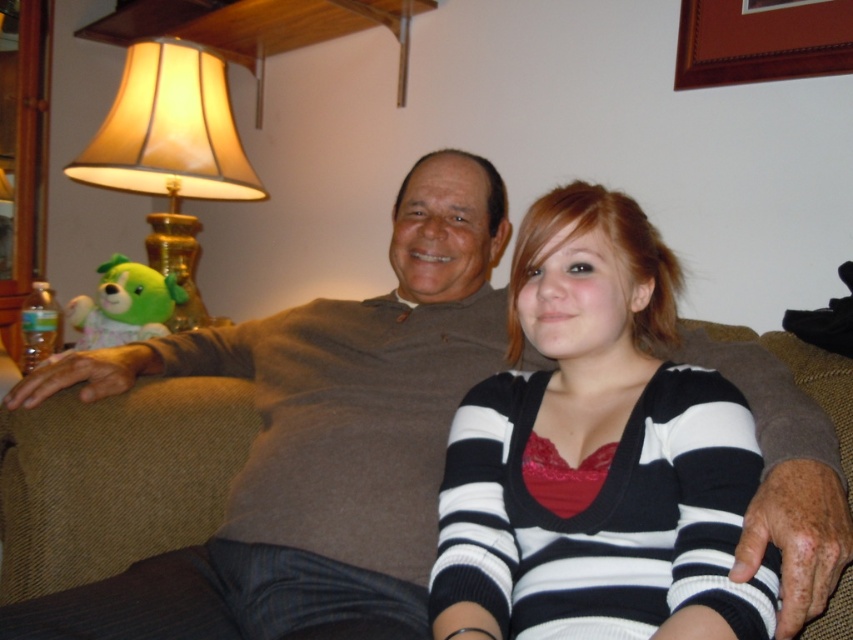
You are designing a living room layout and need to ensure that the striped knit sweater at center can be placed on the brown fabric couch at center. Considering their sizes, will the sweater fit on the couch?

The striped knit sweater at center is smaller than the brown fabric couch at center, so the sweater will fit on the couch since it is smaller in size.

You are designing a new living room layout and want to place a decorative pillow between the striped knit sweater at center and the brown fabric couch at center. Based on their widths, which object should the pillow be closer to?

The striped knit sweater at center has a lesser width compared to the brown fabric couch at center, so the pillow should be closer to the striped knit sweater at center to balance the space.